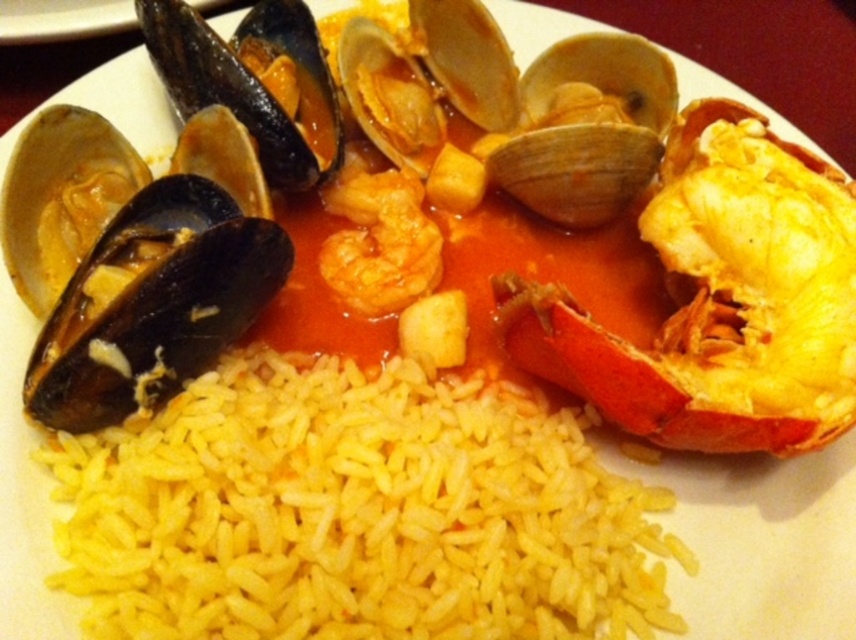
You are a food critic who needs to taste both the yellow polished rice at center and the orange glossy shrimp at center. If your hand can reach 12 inches, can you grab both items without moving your hand?

The yellow polished rice at center is 12.73 inches away from the orange glossy shrimp at center, which is slightly beyond the 12 inch reach of your hand. Therefore, you cannot grab both items without moving your hand.